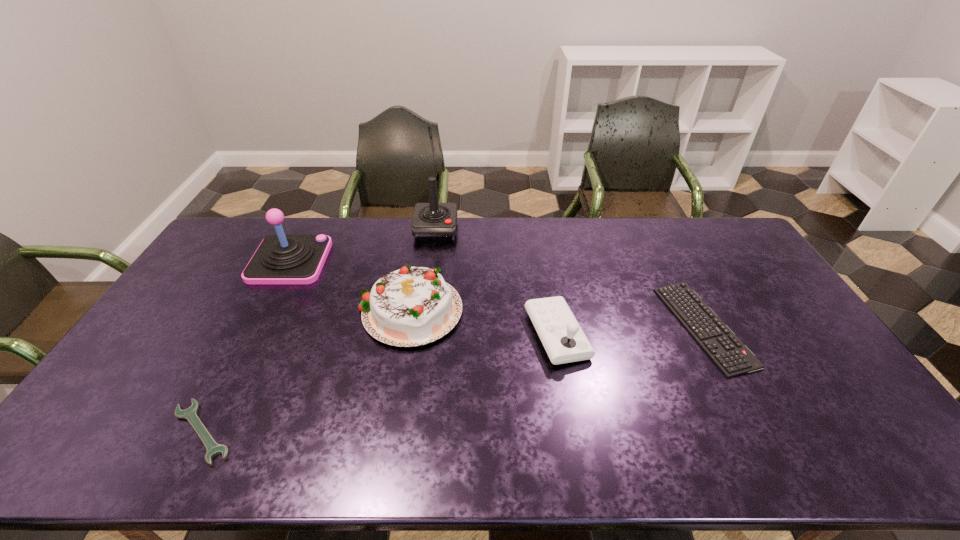
What are the coordinates of `vacant space situated 0.230m forward from the base of the leftmost joystick` in the screenshot? It's located at (391, 261).

Where is `free space located 0.320m on the back of the fourth shortest object`? free space located 0.320m on the back of the fourth shortest object is located at coordinates (425, 220).

Identify the location of vacant space situated 0.130m on the right of the second object from right to left. The width and height of the screenshot is (960, 540). (632, 335).

At what (x,y) coordinates should I click in order to perform the action: click on free region located 0.360m on the back of the fifth tallest object. Please return your answer as a coordinate pair (x, y). The height and width of the screenshot is (540, 960). Looking at the image, I should click on (650, 224).

Identify the location of free space located 0.390m on the right of the nearest object. (400, 431).

Find the location of a particular element. This screenshot has height=540, width=960. object at the near edge is located at coordinates (190, 414).

In the image, there is a desktop. Where is `vacant space at the far edge`? vacant space at the far edge is located at coordinates (465, 238).

The height and width of the screenshot is (540, 960). Find the location of `free space at the near edge`. free space at the near edge is located at coordinates (320, 449).

The height and width of the screenshot is (540, 960). Find the location of `free space at the left edge`. free space at the left edge is located at coordinates (232, 264).

The width and height of the screenshot is (960, 540). Identify the location of free region at the far right corner of the desktop. (745, 253).